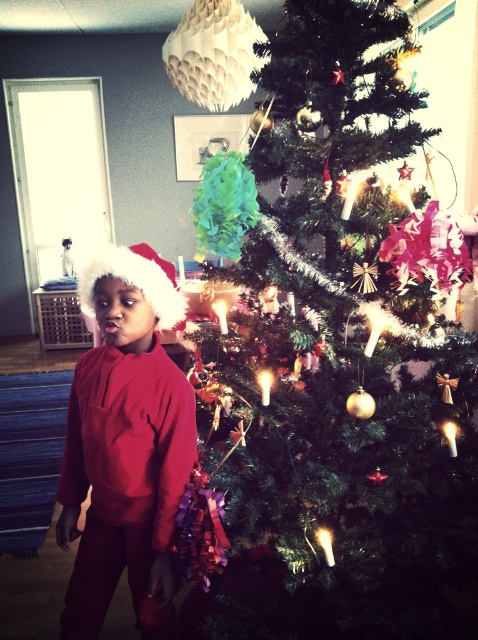
Which of these two, green shiny christmas tree at center or matte red sweater at center, stands shorter?

matte red sweater at center

Is green shiny christmas tree at center above matte red sweater at center?

Indeed, green shiny christmas tree at center is positioned over matte red sweater at center.

You are a GUI agent. You are given a task and a screenshot of the screen. Output one action in this format:
    pyautogui.click(x=<x>, y=<y>)
    Task: Click on the green shiny christmas tree at center
    
    Given the screenshot: What is the action you would take?
    pyautogui.click(x=337, y=355)

Between matte red sweater at center and fuzzy fabric santa hat at left, which one appears on the left side from the viewer's perspective?

matte red sweater at center is more to the left.

Can you confirm if matte red sweater at center is smaller than fuzzy fabric santa hat at left?

No, matte red sweater at center is not smaller than fuzzy fabric santa hat at left.

Locate an element on the screen. The height and width of the screenshot is (640, 478). matte red sweater at center is located at coordinates (126, 444).

From the picture: Does green shiny christmas tree at center appear on the right side of fuzzy fabric santa hat at left?

Indeed, green shiny christmas tree at center is positioned on the right side of fuzzy fabric santa hat at left.

Does green shiny christmas tree at center have a lesser width compared to fuzzy fabric santa hat at left?

Incorrect, green shiny christmas tree at center's width is not less than fuzzy fabric santa hat at left's.

Does point (217, 176) lie behind point (137, 260)?

That is False.

The height and width of the screenshot is (640, 478). Find the location of `green shiny christmas tree at center`. green shiny christmas tree at center is located at coordinates (337, 355).